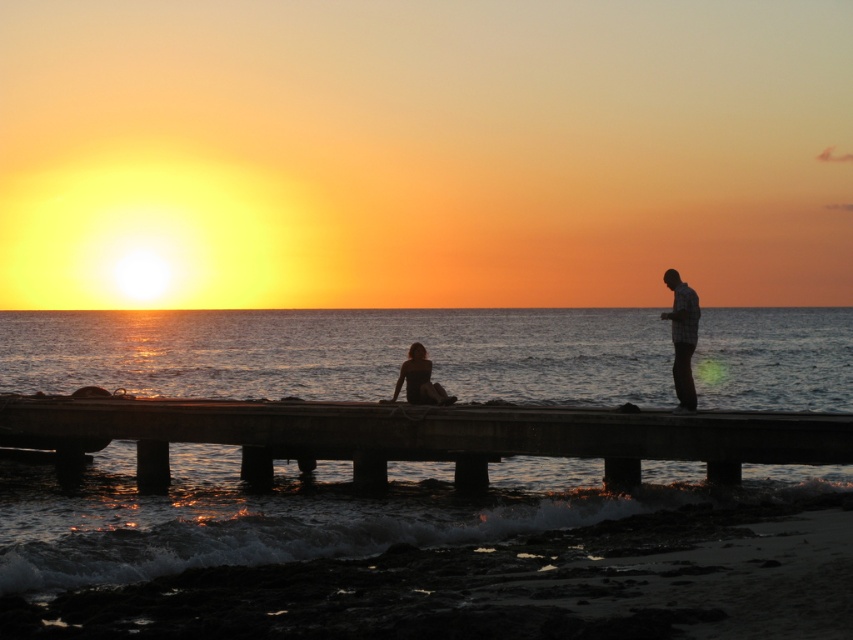
Question: Can you confirm if plaid shirt at right is smaller than silhouette figure at center?

Choices:
 (A) no
 (B) yes

Answer: (A)

Question: Which point is closer to the camera?

Choices:
 (A) concrete dock at center
 (B) dark sand at lower center
 (C) silhouette figure at center
 (D) shiny metallic water at center

Answer: (B)

Question: Considering the relative positions of shiny metallic water at center and concrete dock at center in the image provided, where is shiny metallic water at center located with respect to concrete dock at center?

Choices:
 (A) right
 (B) left

Answer: (B)

Question: Which point is closer to the camera?

Choices:
 (A) (566, 566)
 (B) (688, 376)
 (C) (428, 465)

Answer: (A)

Question: Which of the following is the farthest from the observer?

Choices:
 (A) (840, 548)
 (B) (383, 401)
 (C) (6, 406)

Answer: (C)

Question: Is shiny metallic water at center further to the viewer compared to concrete dock at center?

Choices:
 (A) yes
 (B) no

Answer: (B)